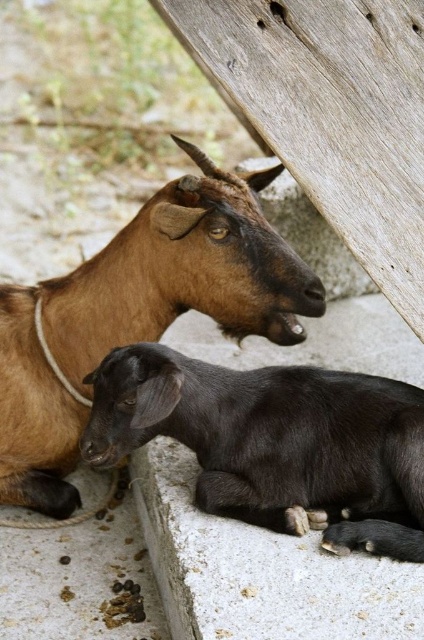
You are a photographer trying to capture both the brown matte goat at center and the black matte goat at lower center in the same frame. Based on their positions, which goat would appear closer to the camera in the photo?

The brown matte goat at center would appear closer to the camera because the black matte goat at lower center is behind it.

You are a photographer standing 1.6 meters tall and want to take a picture of the brown matte goat at center. If your camera lens has a focal length of 50mm, what is the approximate distance you should stand from the goat to capture it in focus?

The brown matte goat at center is 1.90 meters away from the camera. Since you are 1.6 meters tall, you should stand approximately 1.90 meters away from the goat to ensure it is in focus with a 50mm lens.